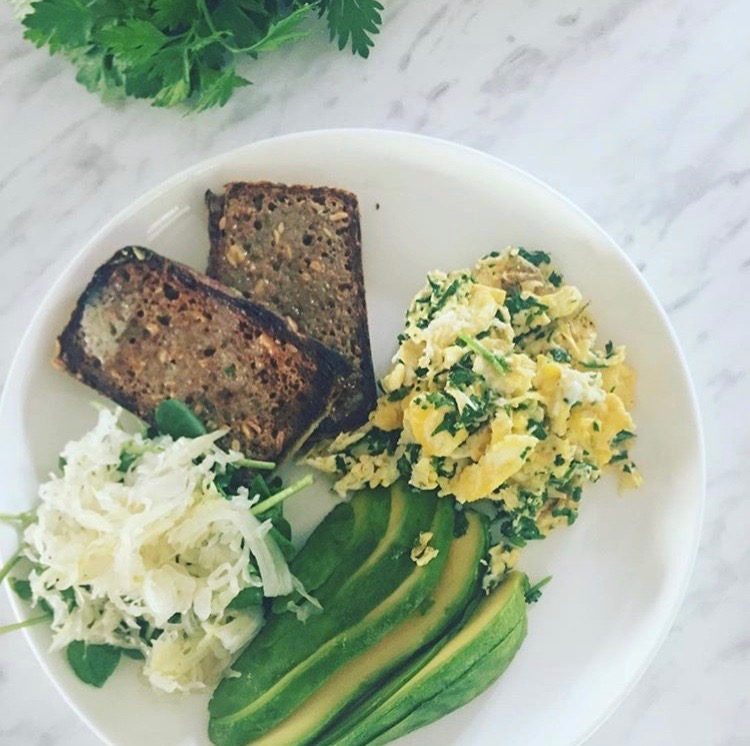
In order to click on marble surface in this screenshot , I will do `click(562, 98)`, `click(722, 689)`, `click(56, 172)`.